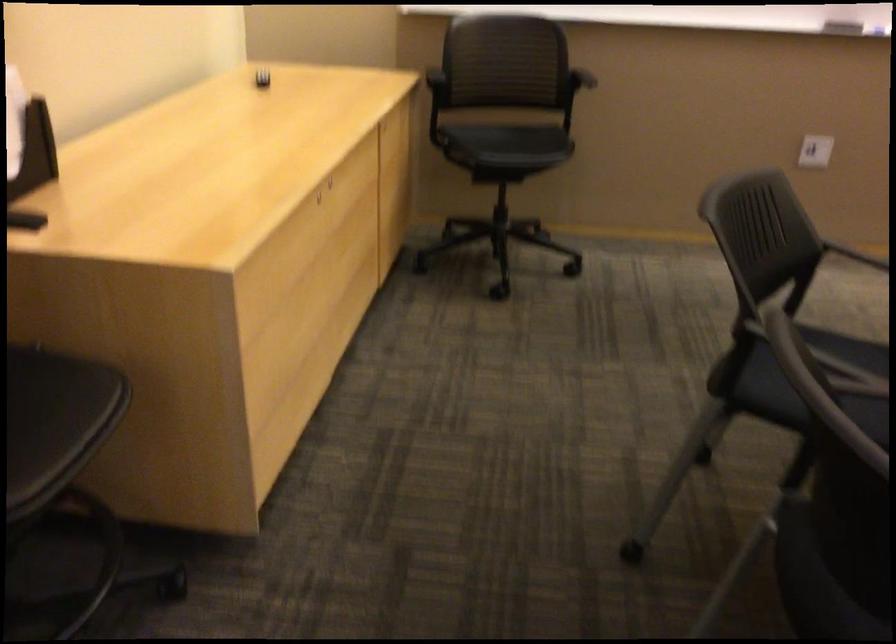
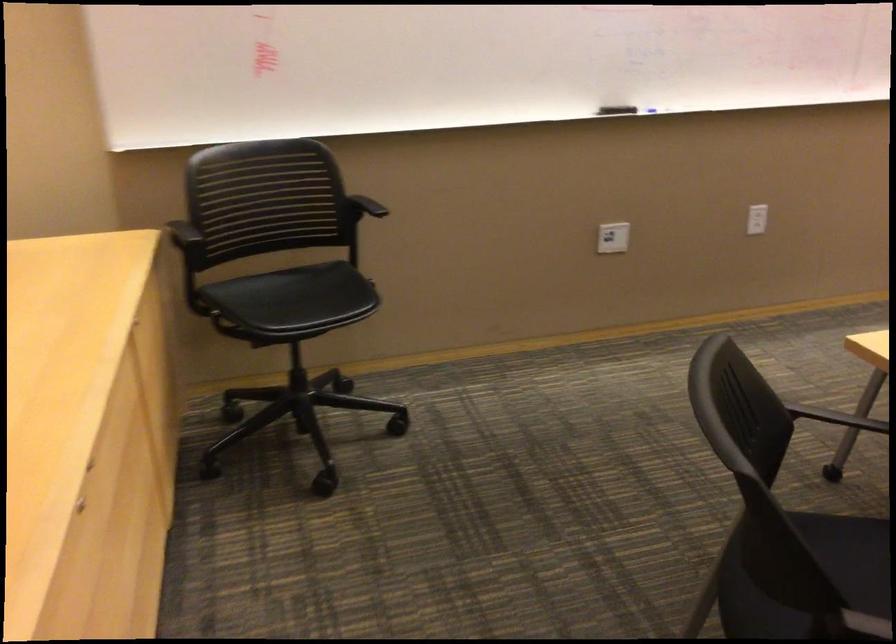
Question: Based on the continuous images, in which direction is the camera rotating? Reply with the corresponding letter.

Choices:
 (A) Left
 (B) Right
 (C) Up
 (D) Down

Answer: (B)